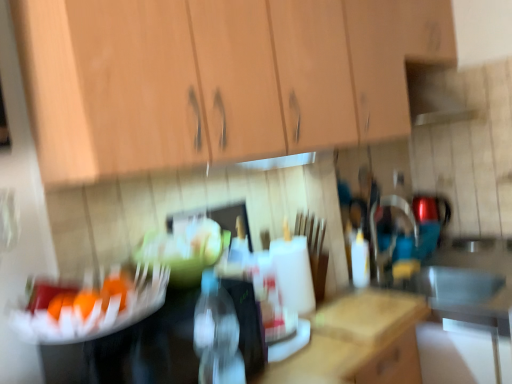
Question: Does white plastic bottle at center, arranged as the 2th bottle when viewed from the front, lie in front of orange matte fruit at center?

Choices:
 (A) no
 (B) yes

Answer: (A)

Question: Is white plastic bottle at center, which appears as the first bottle when viewed from the back, outside of orange matte fruit at center?

Choices:
 (A) yes
 (B) no

Answer: (A)

Question: From the image's perspective, is white plastic bottle at center, arranged as the 2th bottle when viewed from the left, above orange matte fruit at center?

Choices:
 (A) yes
 (B) no

Answer: (B)

Question: Are white plastic bottle at center, arranged as the 2th bottle when viewed from the left, and orange matte fruit at center far apart?

Choices:
 (A) yes
 (B) no

Answer: (A)

Question: Considering the relative sizes of white plastic bottle at center, arranged as the 2th bottle when viewed from the left, and orange matte fruit at center in the image provided, is white plastic bottle at center, arranged as the 2th bottle when viewed from the left, wider than orange matte fruit at center?

Choices:
 (A) yes
 (B) no

Answer: (A)

Question: Does white plastic bottle at center, arranged as the 2th bottle when viewed from the left, have a smaller size compared to orange matte fruit at center?

Choices:
 (A) no
 (B) yes

Answer: (A)

Question: Considering the relative sizes of orange matte fruit at center and transparent plastic bottle at center, which is the 1th bottle in front-to-back order, in the image provided, is orange matte fruit at center shorter than transparent plastic bottle at center, which is the 1th bottle in front-to-back order,?

Choices:
 (A) yes
 (B) no

Answer: (A)

Question: From the image's perspective, would you say orange matte fruit at center is shown under transparent plastic bottle at center, the second bottle from the right?

Choices:
 (A) yes
 (B) no

Answer: (B)

Question: From the image's perspective, is orange matte fruit at center over transparent plastic bottle at center, positioned as the first bottle in left-to-right order?

Choices:
 (A) no
 (B) yes

Answer: (B)

Question: Is orange matte fruit at center far from transparent plastic bottle at center, the second bottle from the right?

Choices:
 (A) yes
 (B) no

Answer: (B)

Question: Considering the relative sizes of orange matte fruit at center and transparent plastic bottle at center, the second bottle positioned from the back, in the image provided, is orange matte fruit at center bigger than transparent plastic bottle at center, the second bottle positioned from the back,?

Choices:
 (A) no
 (B) yes

Answer: (A)

Question: Could you tell me if orange matte fruit at center is facing transparent plastic bottle at center, the second bottle positioned from the back?

Choices:
 (A) no
 (B) yes

Answer: (B)

Question: Considering the relative sizes of orange matte fruit at center and white plastic bottle at center, the first bottle when ordered from right to left, in the image provided, is orange matte fruit at center taller than white plastic bottle at center, the first bottle when ordered from right to left,?

Choices:
 (A) yes
 (B) no

Answer: (B)